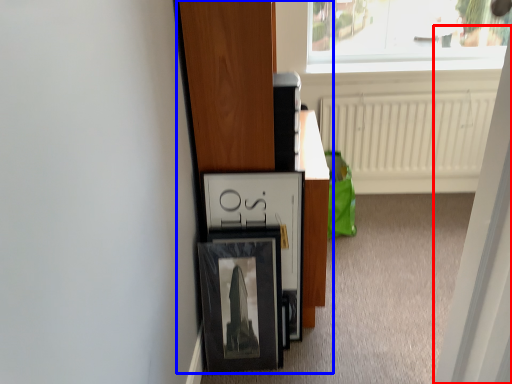
Question: Which point is closer to the camera, screen door (highlighted by a red box) or furniture (highlighted by a blue box)?

Choices:
 (A) screen door
 (B) furniture

Answer: (A)